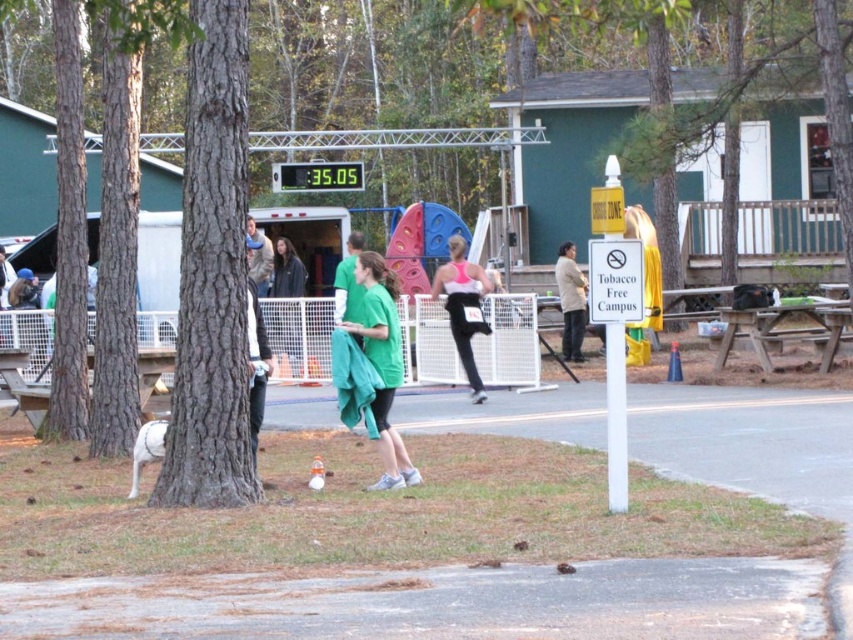
Is green matte shirt at center smaller than green fabric at center?

No.

Looking at this image, who is taller, green matte shirt at center or green fabric at center?

green matte shirt at center is taller.

Find the location of a particular element. green matte shirt at center is located at coordinates (383, 362).

This screenshot has width=853, height=640. I want to click on green matte shirt at center, so click(x=383, y=362).

Which is more to the right, white matte tank top at center or tan fabric jacket at center?

tan fabric jacket at center

Between point (467, 353) and point (575, 307), which one is positioned behind?

Positioned behind is point (575, 307).

Who is more forward, (x=488, y=284) or (x=581, y=301)?

Point (x=488, y=284)

The height and width of the screenshot is (640, 853). Find the location of `white matte tank top at center`. white matte tank top at center is located at coordinates (463, 305).

Does white matte tank top at center have a lesser width compared to green fabric shirt at center?

Indeed, white matte tank top at center has a lesser width compared to green fabric shirt at center.

Is white matte tank top at center to the left of green fabric shirt at center from the viewer's perspective?

Incorrect, white matte tank top at center is not on the left side of green fabric shirt at center.

Does point (477, 387) lie behind point (257, 241)?

No, it is in front of (257, 241).

The height and width of the screenshot is (640, 853). In order to click on white matte tank top at center in this screenshot , I will do `click(463, 305)`.